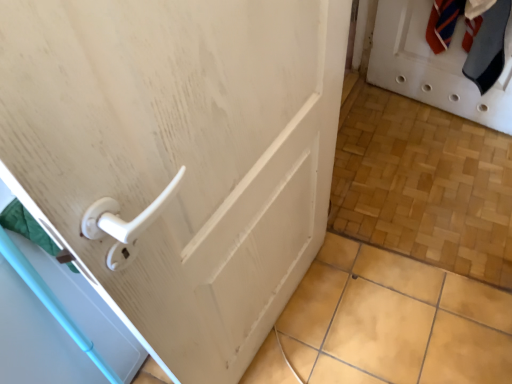
Question: Is white matte door at upper right to the left or to the right of white plastic handle at left in the image?

Choices:
 (A) right
 (B) left

Answer: (A)

Question: In terms of height, does white matte door at upper right look taller or shorter compared to white plastic handle at left?

Choices:
 (A) short
 (B) tall

Answer: (A)

Question: Considering the positions of white matte door at upper right and white plastic handle at left in the image, is white matte door at upper right bigger or smaller than white plastic handle at left?

Choices:
 (A) small
 (B) big

Answer: (A)

Question: In terms of height, does white plastic handle at left look taller or shorter compared to white matte door at upper right?

Choices:
 (A) short
 (B) tall

Answer: (B)

Question: Which is correct: white plastic handle at left is inside white matte door at upper right, or outside of it?

Choices:
 (A) outside
 (B) inside

Answer: (A)

Question: From a real-world perspective, is white plastic handle at left physically located above or below white matte door at upper right?

Choices:
 (A) above
 (B) below

Answer: (B)

Question: Looking at the image, does white plastic handle at left seem bigger or smaller compared to white matte door at upper right?

Choices:
 (A) small
 (B) big

Answer: (B)